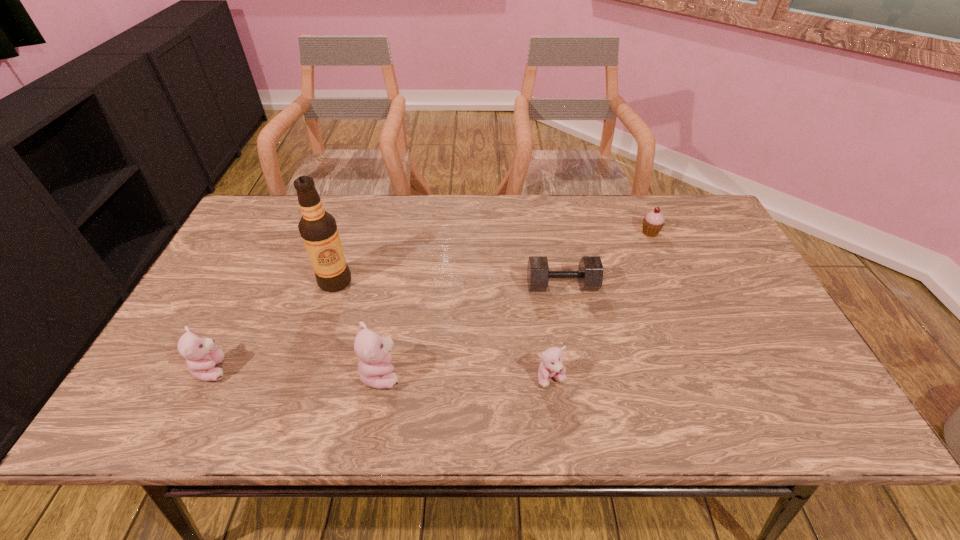
The height and width of the screenshot is (540, 960). Identify the location of vacant region located 0.050m at the face of the fourth shortest object. (252, 369).

Where is `vacant space located at the face of the second tallest object`? The image size is (960, 540). vacant space located at the face of the second tallest object is located at coordinates (520, 374).

Find the location of a particular element. free spot located on the left of the cupcake is located at coordinates (545, 233).

Where is `vacant position located 0.070m on the left of the dumbbell`? vacant position located 0.070m on the left of the dumbbell is located at coordinates (502, 285).

Where is `free space located 0.150m on the label of the alcohol`? free space located 0.150m on the label of the alcohol is located at coordinates (317, 339).

Where is `object present at the far edge`? The width and height of the screenshot is (960, 540). object present at the far edge is located at coordinates (653, 222).

At what (x,y) coordinates should I click in order to perform the action: click on object located at the left edge. Please return your answer as a coordinate pair (x, y). The width and height of the screenshot is (960, 540). Looking at the image, I should click on tap(201, 354).

You are a GUI agent. You are given a task and a screenshot of the screen. Output one action in this format:
    pyautogui.click(x=<x>, y=<y>)
    Task: Click on the object located at the near left corner
    The width and height of the screenshot is (960, 540).
    Given the screenshot: What is the action you would take?
    pyautogui.click(x=201, y=354)

Where is `free region at the far edge`? free region at the far edge is located at coordinates (468, 233).

You are a GUI agent. You are given a task and a screenshot of the screen. Output one action in this format:
    pyautogui.click(x=<x>, y=<y>)
    Task: Click on the vacant point at the near edge
    
    Given the screenshot: What is the action you would take?
    (331, 390)